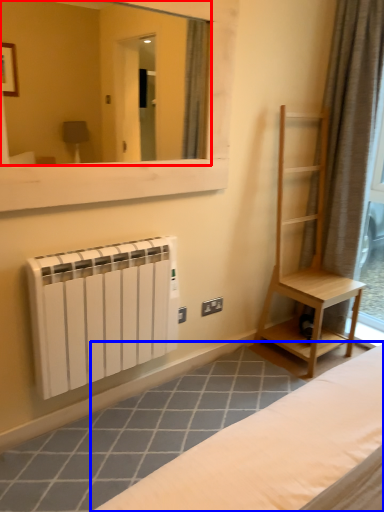
Question: Among these objects, which one is nearest to the camera, mirror (highlighted by a red box) or furniture (highlighted by a blue box)?

Choices:
 (A) mirror
 (B) furniture

Answer: (A)